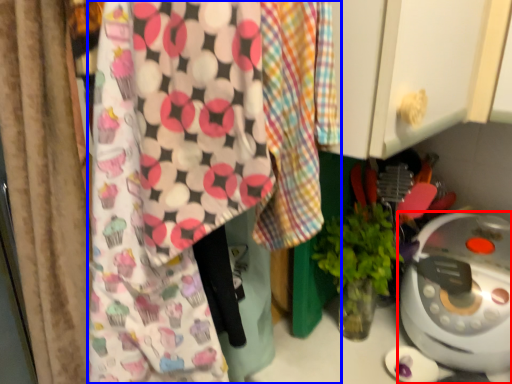
Question: Which object is further to the camera taking this photo, home appliance (highlighted by a red box) or wrapping paper (highlighted by a blue box)?

Choices:
 (A) home appliance
 (B) wrapping paper

Answer: (A)